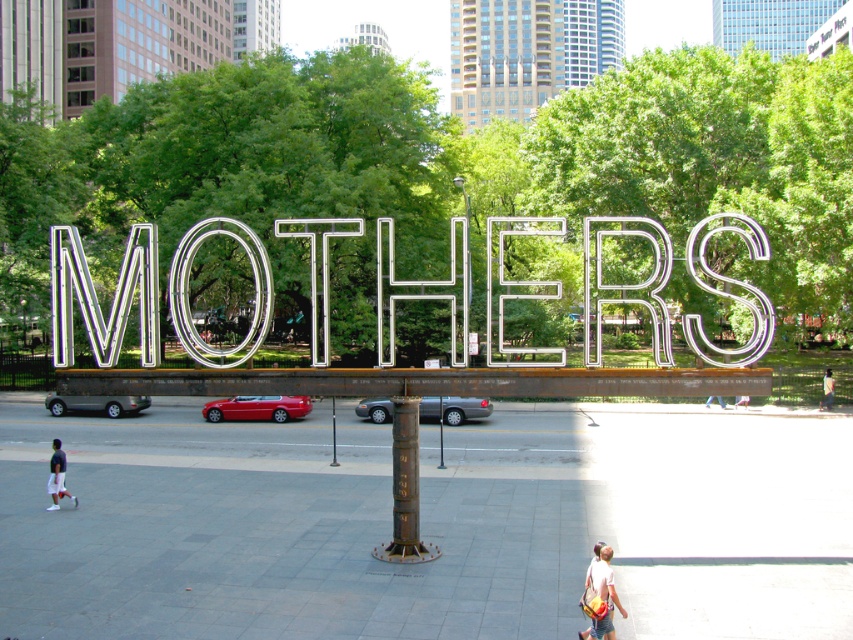
Can you confirm if gray concrete pavement at center is positioned above light pink fabric shirt at lower right?

No, gray concrete pavement at center is not above light pink fabric shirt at lower right.

Who is more forward, (49, 620) or (596, 550)?

Point (596, 550) is in front.

Is point (810, 593) closer to camera compared to point (602, 557)?

No, (810, 593) is further to viewer.

Find the location of a particular element. This screenshot has height=640, width=853. gray concrete pavement at center is located at coordinates pos(427,524).

Is light pink fabric shirt at lower right wider than light brown leather jacket at lower right?

Yes.

Is light pink fabric shirt at lower right to the left of light brown leather jacket at lower right from the viewer's perspective?

Indeed, light pink fabric shirt at lower right is positioned on the left side of light brown leather jacket at lower right.

Locate an element on the screen. This screenshot has height=640, width=853. light pink fabric shirt at lower right is located at coordinates (602, 593).

Locate an element on the screen. The height and width of the screenshot is (640, 853). light pink fabric shirt at lower right is located at coordinates (602, 593).

Is gray concrete pavement at center above light brown leather jacket at lower right?

Incorrect, gray concrete pavement at center is not positioned above light brown leather jacket at lower right.

From the picture: Is gray concrete pavement at center taller than light brown leather jacket at lower right?

Yes.

Between point (486, 512) and point (822, 396), which one is positioned behind?

Point (822, 396)

Find the location of a particular element. The image size is (853, 640). gray concrete pavement at center is located at coordinates (427, 524).